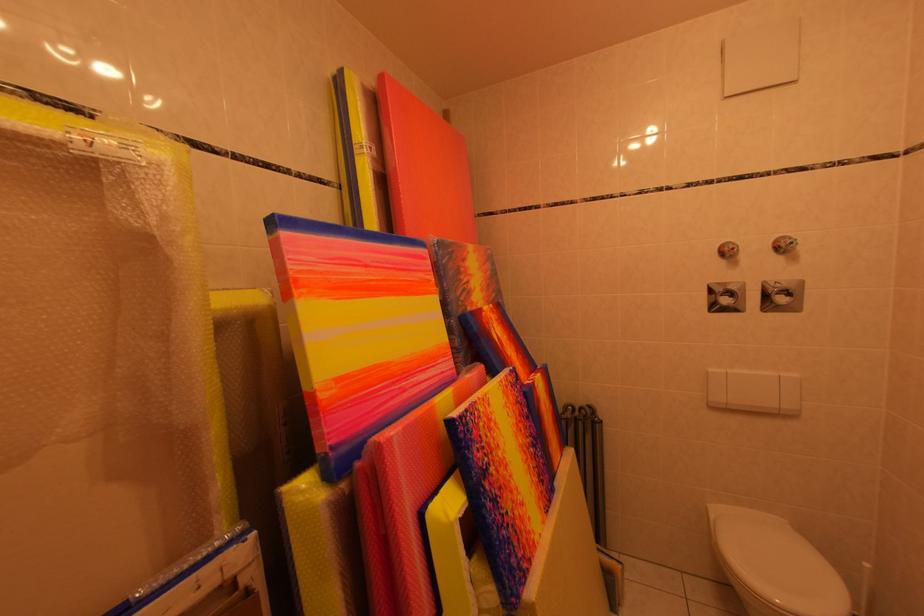
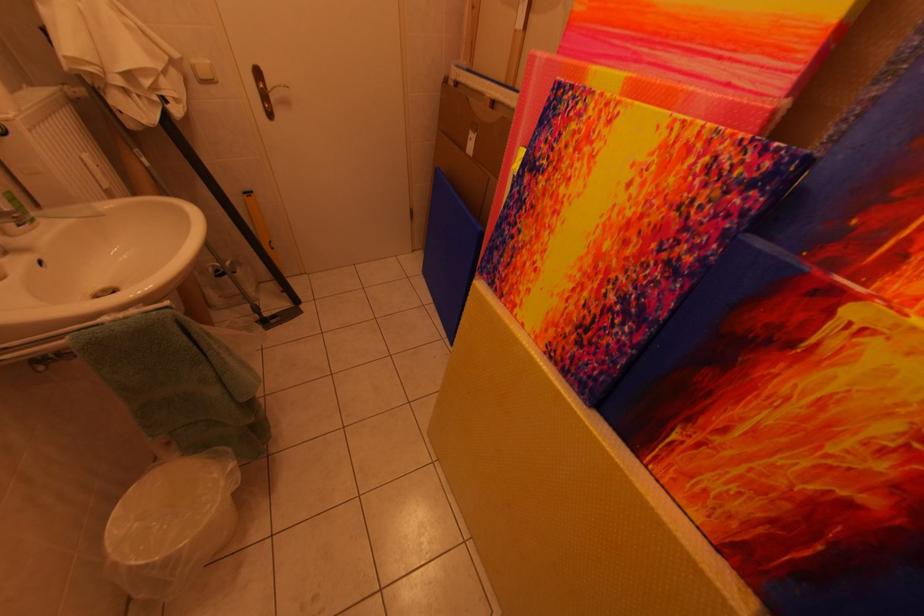
Locate, in the second image, the point that corresponds to (544,389) in the first image.

(861, 317)